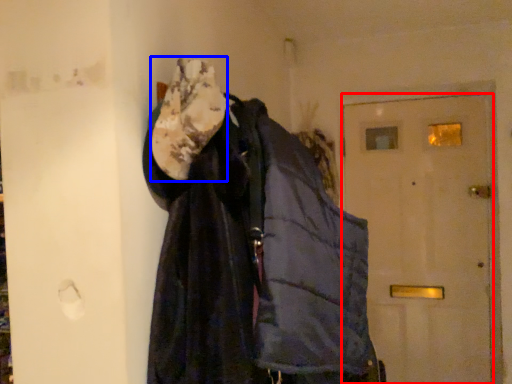
Question: Which object appears closest to the camera in this image, door (highlighted by a red box) or scarf (highlighted by a blue box)?

Choices:
 (A) door
 (B) scarf

Answer: (B)